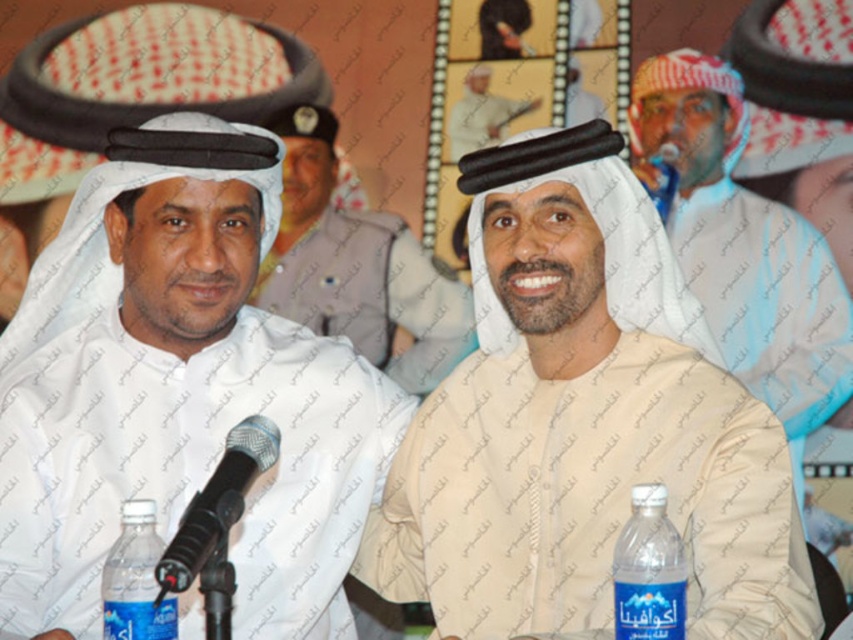
Does white matte headscarf at left appear on the right side of blue plastic bottle at lower left?

Indeed, white matte headscarf at left is positioned on the right side of blue plastic bottle at lower left.

Does point (181, 403) come in front of point (143, 564)?

No, it is not.

Where is `white matte headscarf at left`? The height and width of the screenshot is (640, 853). white matte headscarf at left is located at coordinates (178, 401).

Is white matte headscarf at left below white matte headscarf at center?

Yes, white matte headscarf at left is below white matte headscarf at center.

Looking at this image, is white matte headscarf at left to the right of white matte headscarf at center from the viewer's perspective?

In fact, white matte headscarf at left is to the left of white matte headscarf at center.

Between point (183, 312) and point (409, 308), which one is positioned in front?

Point (183, 312) is in front.

What are the coordinates of `white matte headscarf at left` in the screenshot? It's located at tap(178, 401).

Is blue transparent bottle at lower right thinner than light beige fabric at upper center?

Correct, blue transparent bottle at lower right's width is less than light beige fabric at upper center's.

Does blue transparent bottle at lower right have a smaller size compared to light beige fabric at upper center?

Yes.

This screenshot has height=640, width=853. I want to click on blue transparent bottle at lower right, so click(x=648, y=570).